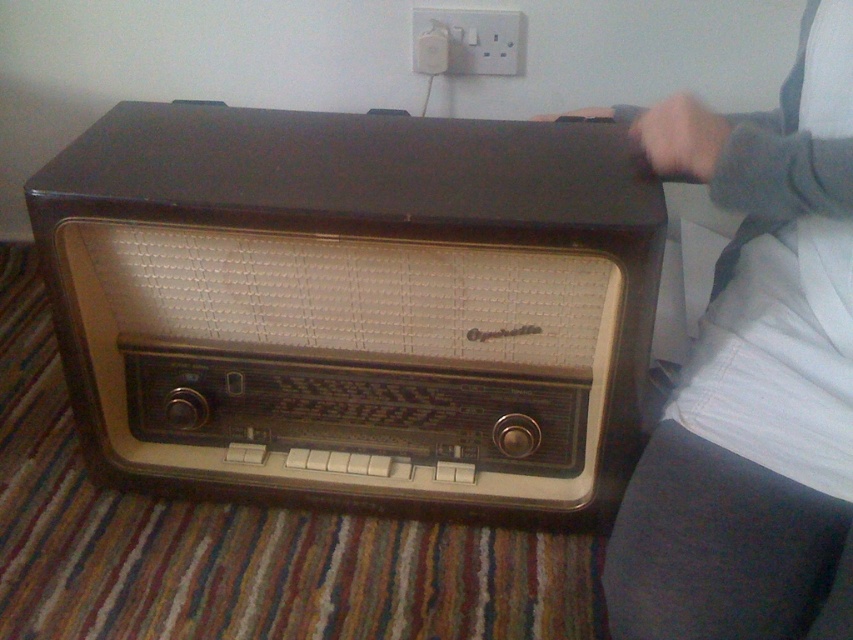
Between point (325, 326) and point (656, 104), which one is positioned behind?

The point (656, 104) is more distant.

Measure the distance between matte black radio at center and gray fabric at upper right.

matte black radio at center is 27.41 centimeters from gray fabric at upper right.

Which is in front, point (494, 372) or point (848, 60)?

Point (848, 60) is more forward.

This screenshot has height=640, width=853. Identify the location of matte black radio at center. (357, 307).